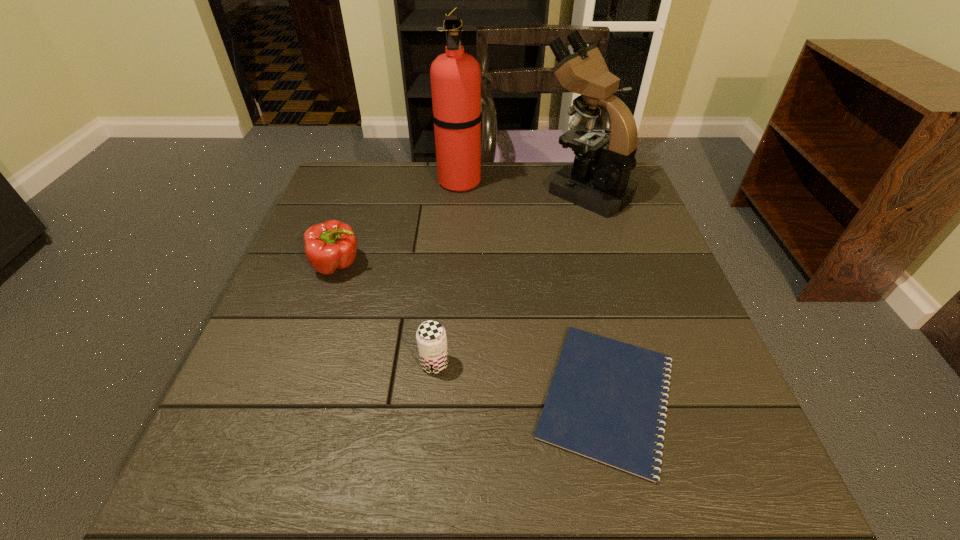
Where is `free space that satisfies the following two spatial constraints: 1. on the front side of the beer can; 2. on the right side of the notepad`? The width and height of the screenshot is (960, 540). free space that satisfies the following two spatial constraints: 1. on the front side of the beer can; 2. on the right side of the notepad is located at coordinates (432, 396).

The width and height of the screenshot is (960, 540). I want to click on vacant space that satisfies the following two spatial constraints: 1. at the nozzle of the notepad; 2. on the right side of the fire extinguisher, so click(446, 396).

Where is `vacant space that satisfies the following two spatial constraints: 1. at the nozzle of the fire extinguisher; 2. on the back side of the shortest object`? Image resolution: width=960 pixels, height=540 pixels. vacant space that satisfies the following two spatial constraints: 1. at the nozzle of the fire extinguisher; 2. on the back side of the shortest object is located at coordinates (446, 396).